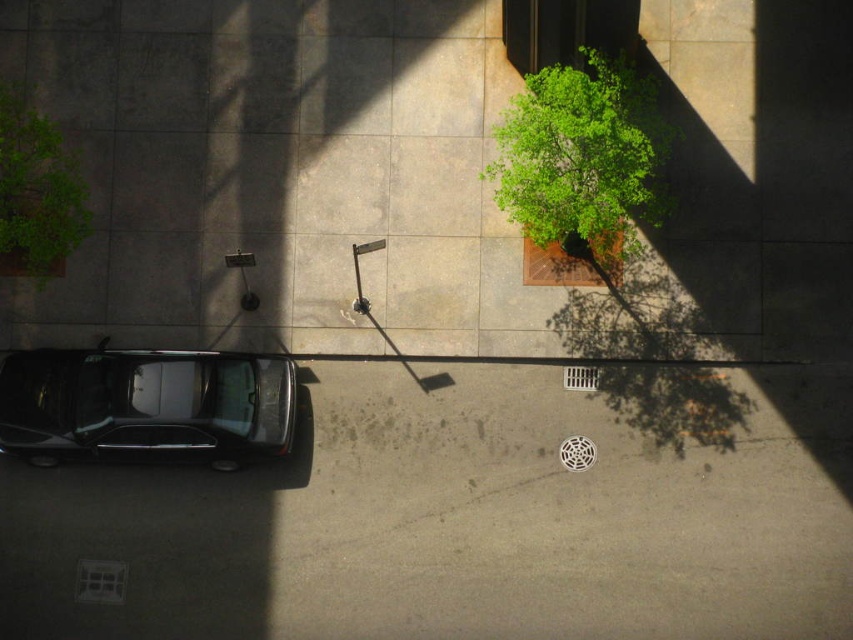
Question: Can you confirm if shiny black car at lower left is bigger than green leafy tree at upper center?

Choices:
 (A) yes
 (B) no

Answer: (B)

Question: Which is farther from the green leafy plant at upper left?

Choices:
 (A) green leafy tree at upper center
 (B) shiny black car at lower left

Answer: (A)

Question: In this image, where is shiny black car at lower left located relative to green leafy tree at upper center?

Choices:
 (A) right
 (B) left

Answer: (B)

Question: Among these objects, which one is nearest to the camera?

Choices:
 (A) green leafy plant at upper left
 (B) green leafy tree at upper center

Answer: (B)

Question: Which is nearer to the green leafy plant at upper left?

Choices:
 (A) shiny black car at lower left
 (B) green leafy tree at upper center

Answer: (A)

Question: Is shiny black car at lower left bigger than green leafy tree at upper center?

Choices:
 (A) yes
 (B) no

Answer: (B)